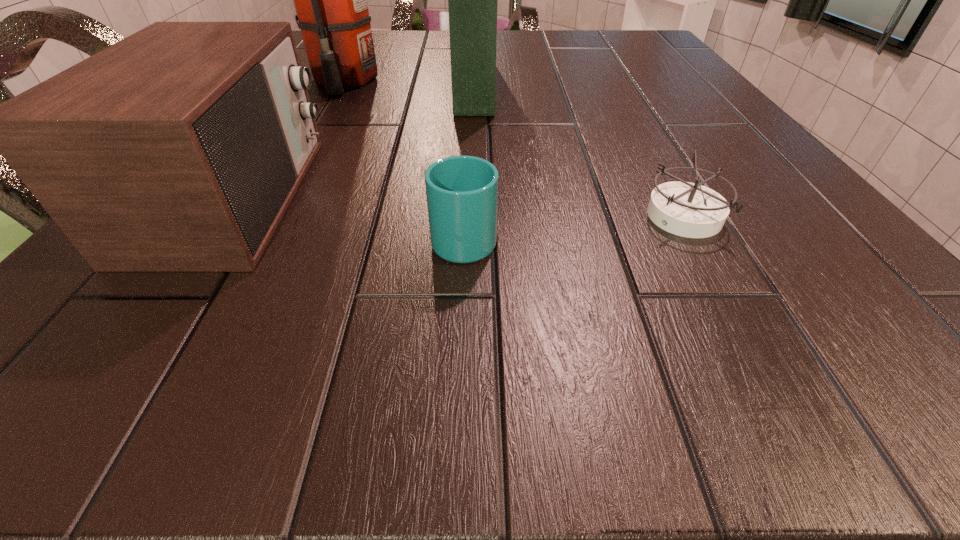
Locate an element on the screen. free space located on the handle side of the second shortest object is located at coordinates (468, 125).

Identify the location of vacant space located 0.150m on the handle side of the second shortest object. This screenshot has width=960, height=540. (468, 156).

Where is `free space located 0.100m on the left of the compass`? This screenshot has height=540, width=960. free space located 0.100m on the left of the compass is located at coordinates (572, 217).

The width and height of the screenshot is (960, 540). I want to click on object present at the far edge, so click(472, 0).

Where is `fire extinguisher at the left edge`? fire extinguisher at the left edge is located at coordinates (330, 0).

At what (x,y) coordinates should I click in order to perform the action: click on radio receiver present at the left edge. Please return your answer as a coordinate pair (x, y). Looking at the image, I should click on (178, 149).

Where is `object located in the right edge section of the desktop`? This screenshot has height=540, width=960. object located in the right edge section of the desktop is located at coordinates (686, 209).

Locate an element on the screen. The height and width of the screenshot is (540, 960). vacant space at the far edge is located at coordinates (534, 48).

In order to click on vacant region at the near edge of the desktop in this screenshot , I will do `click(758, 332)`.

The height and width of the screenshot is (540, 960). In order to click on vacant space at the right edge of the desktop in this screenshot , I will do `click(658, 96)`.